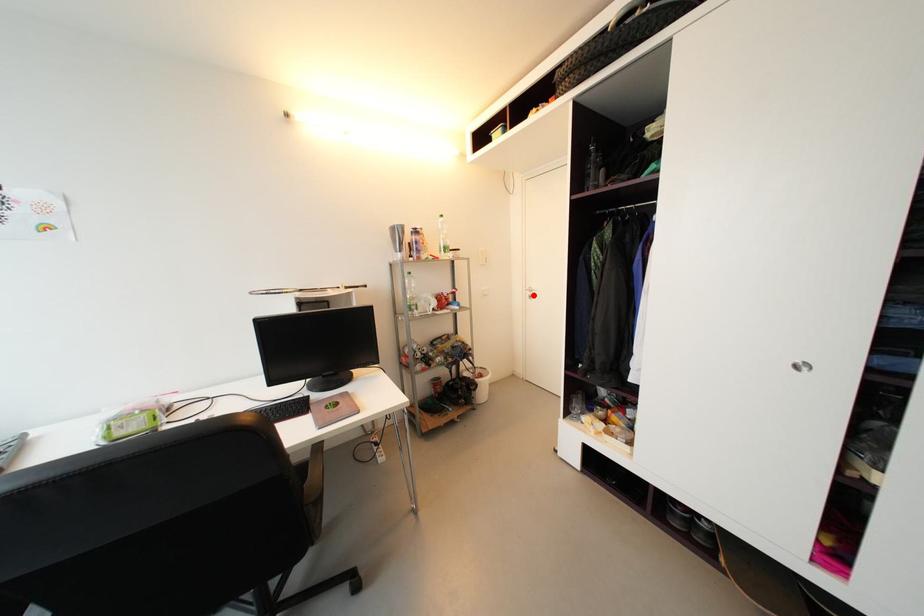
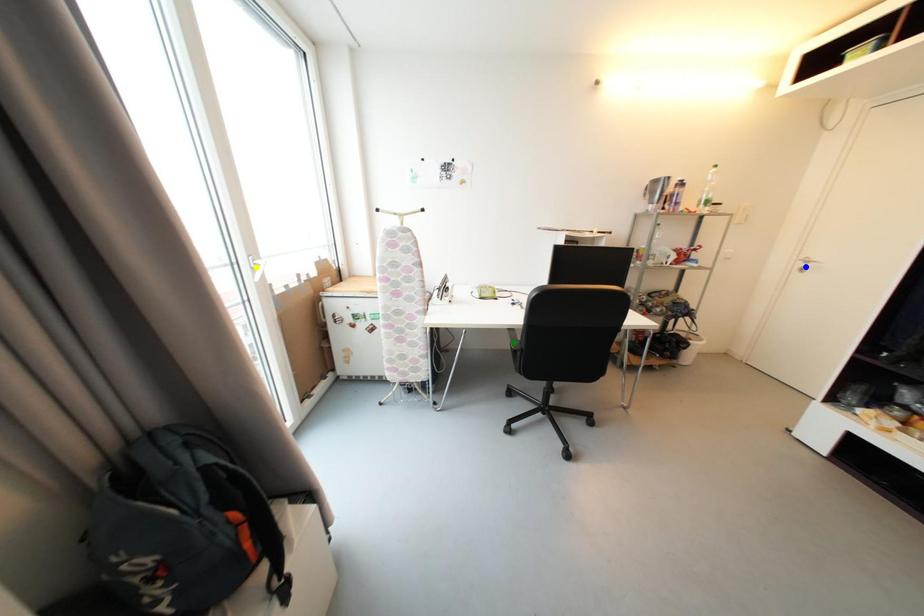
Question: I am providing you with two images of the same scene from different viewpoints. A red point is marked on the first image. You are given multiple points on the second image. Which spot in image 2 lines up with the point in image 1?

Choices:
 (A) yellow point
 (B) green point
 (C) blue point

Answer: (C)